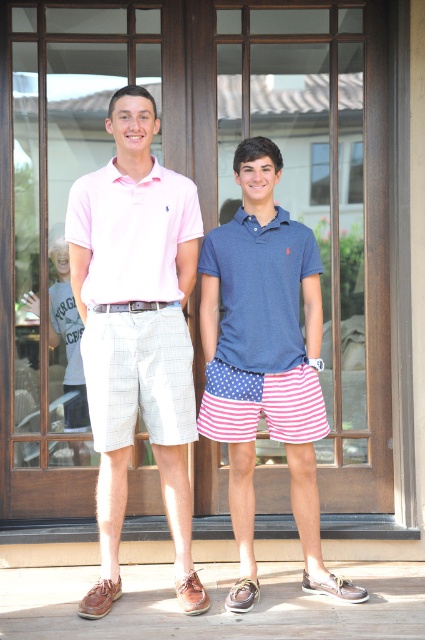
You are standing in front of a wooden door with glass panels and see two people posing for a photo. There is a point marked at coordinates (136, 330). What object is located at that point?

The point at coordinates (136, 330) indicates the pink cotton polo shirt at center.

You are a photographer trying to capture a group photo. You notice two people wearing the pink cotton polo shirt at center and the blue cotton polo shirt at center. Which one is positioned more to the left side of the frame?

The pink cotton polo shirt at center is positioned more to the left side of the frame compared to the blue cotton polo shirt at center.